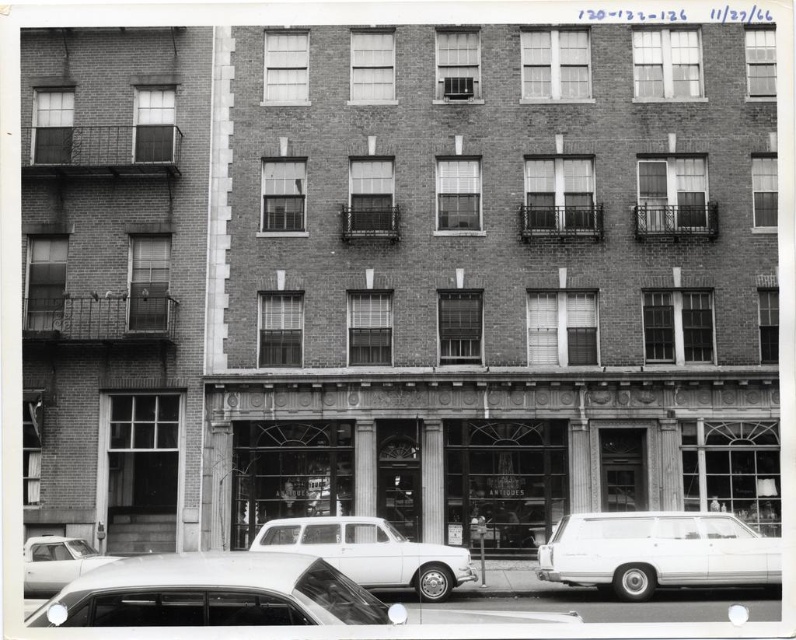
Is point (219, 560) closer to camera compared to point (451, 580)?

Yes, it is in front of point (451, 580).

Looking at this image, is shiny silver sedan at lower left smaller than white matte station wagon at center?

No.

Is point (217, 586) behind point (461, 570)?

No, it is in front of (461, 570).

Find the location of a particular element. shiny silver sedan at lower left is located at coordinates (213, 593).

Is shiny silver sedan at lower left to the right of white glossy station wagon at lower right from the viewer's perspective?

No, shiny silver sedan at lower left is not to the right of white glossy station wagon at lower right.

Which is in front, point (322, 621) or point (718, 557)?

Positioned in front is point (322, 621).

You are a GUI agent. You are given a task and a screenshot of the screen. Output one action in this format:
    pyautogui.click(x=<x>, y=<y>)
    Task: Click on the shiny silver sedan at lower left
    This screenshot has width=796, height=640.
    Given the screenshot: What is the action you would take?
    pyautogui.click(x=213, y=593)

Image resolution: width=796 pixels, height=640 pixels. Describe the element at coordinates (657, 552) in the screenshot. I see `white glossy station wagon at lower right` at that location.

Which is behind, point (748, 577) or point (80, 548)?

Positioned behind is point (80, 548).

Between point (681, 531) and point (90, 552), which one is positioned in front?

Positioned in front is point (681, 531).

Identify the location of white glossy station wagon at lower right. The height and width of the screenshot is (640, 796). (657, 552).